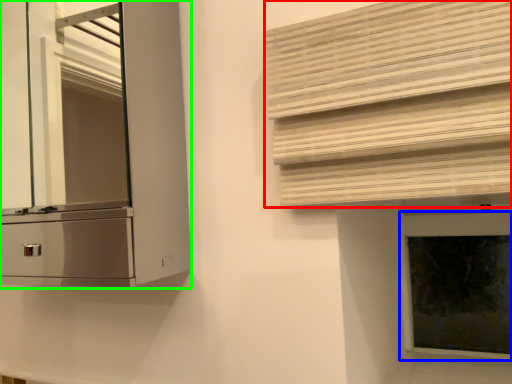
Question: Which is nearer to the shutter (highlighted by a red box)? window frame (highlighted by a blue box) or cabinetry (highlighted by a green box).

Choices:
 (A) window frame
 (B) cabinetry

Answer: (A)